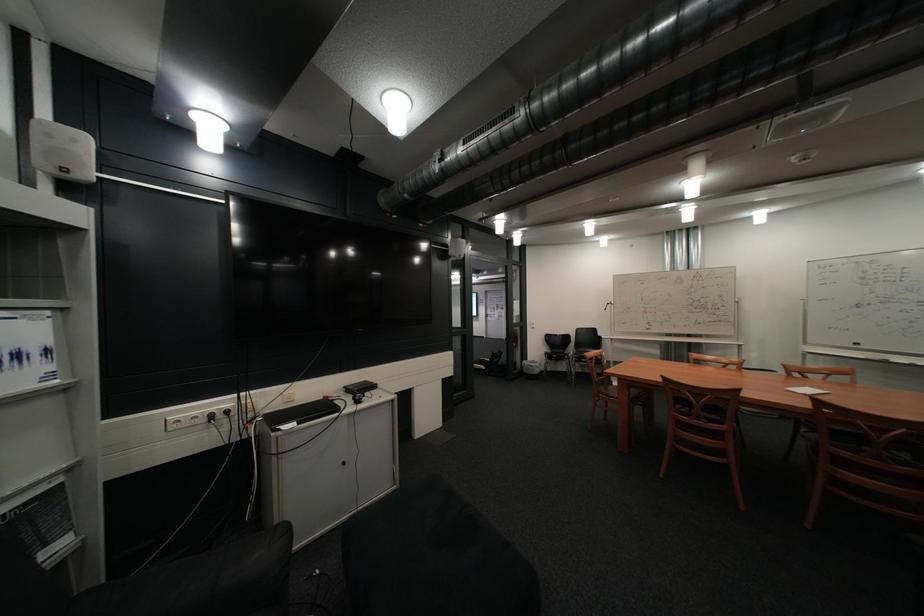
I want to click on white booklet, so click(38, 390).